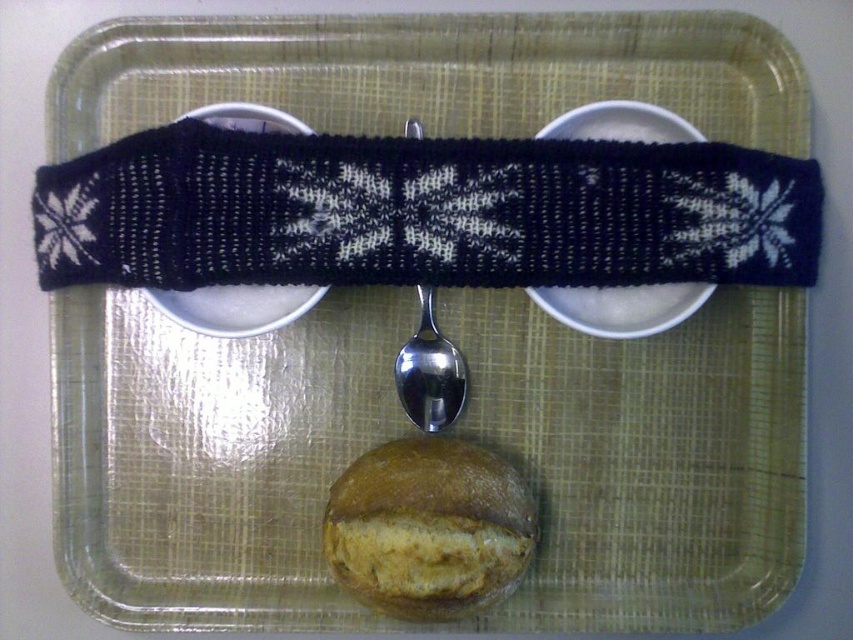
Question: Which point is farther to the camera?

Choices:
 (A) (479, 476)
 (B) (216, 289)
 (C) (432, 408)
 (D) (659, 285)

Answer: (C)

Question: Which is farther from the golden brown crusty bread at center?

Choices:
 (A) black knitted plate at center
 (B) black knitted band at upper center

Answer: (B)

Question: Among these objects, which one is nearest to the camera?

Choices:
 (A) satin silver spoon at center
 (B) black knitted plate at center

Answer: (B)

Question: Does golden brown crusty bread at center appear under black knitted plate at center?

Choices:
 (A) yes
 (B) no

Answer: (A)

Question: Is black knitted plate at center wider than satin silver spoon at center?

Choices:
 (A) no
 (B) yes

Answer: (B)

Question: Is black knitted plate at center to the left of satin silver spoon at center from the viewer's perspective?

Choices:
 (A) no
 (B) yes

Answer: (B)